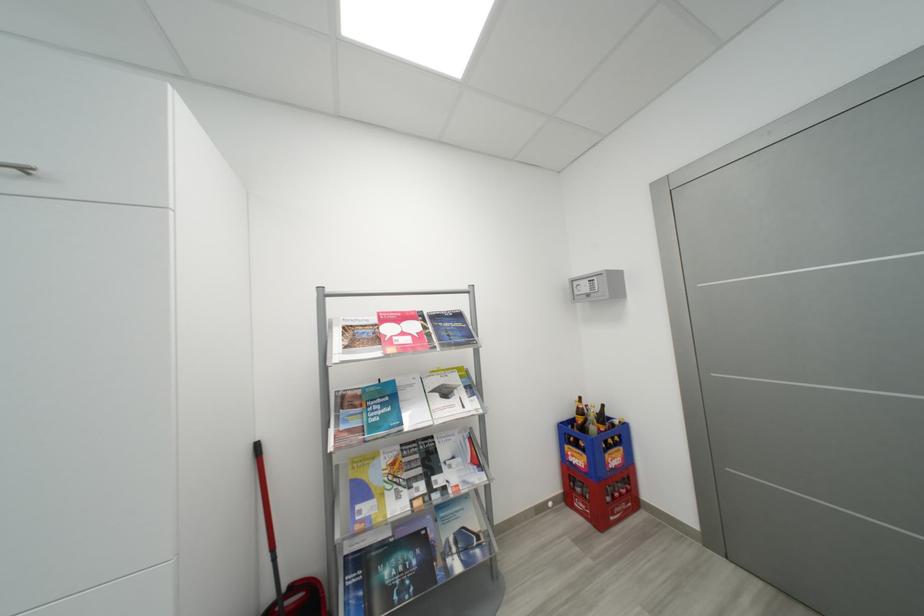
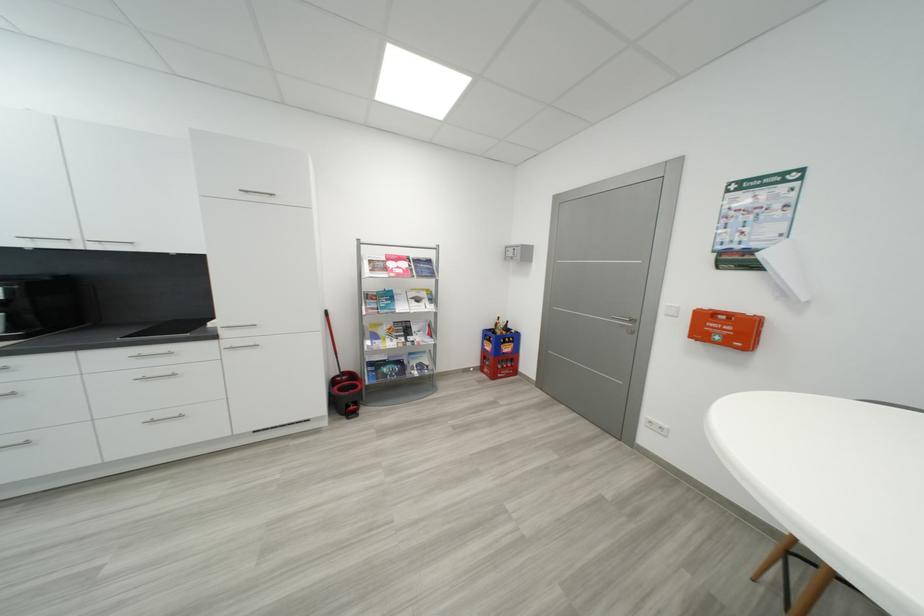
Where in the second image is the point corresponding to (x=385, y=342) from the first image?

(393, 270)